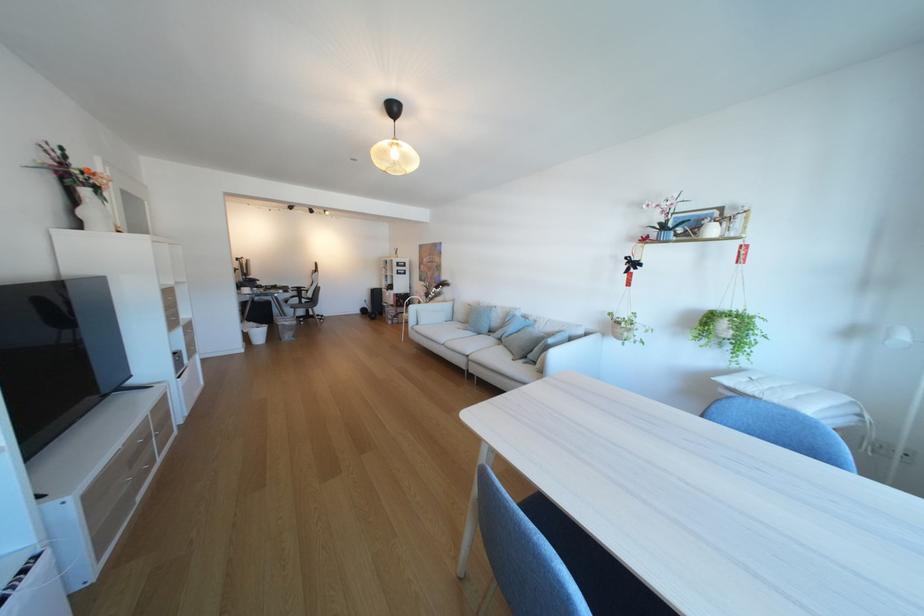
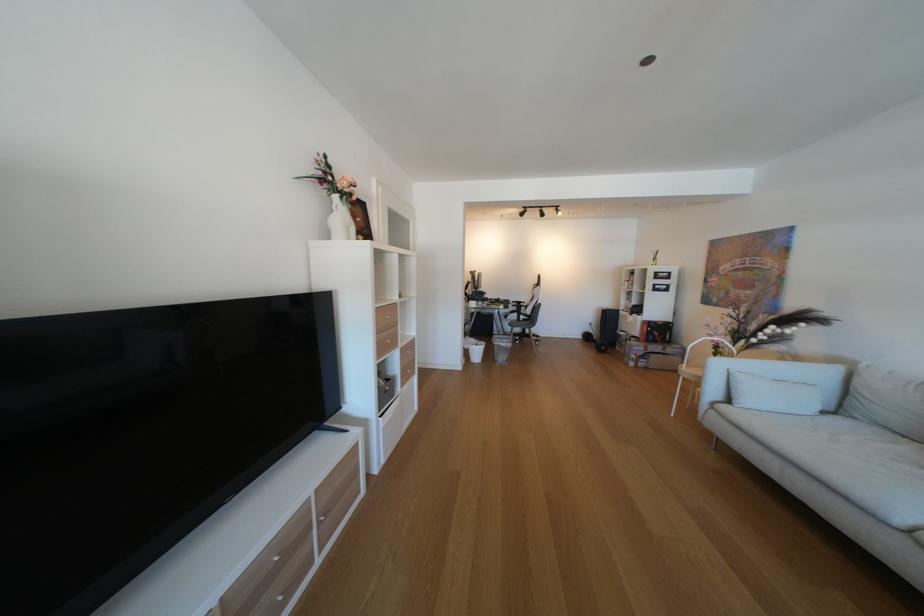
Where in the second image is the point corresponding to (x=422, y=323) from the first image?

(723, 392)